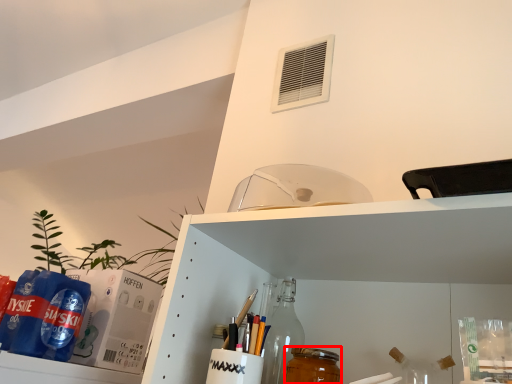
Question: From the image's perspective, considering the relative positions of beverage (annotated by the red box) and air conditioning in the image provided, where is beverage (annotated by the red box) located with respect to the staircase?

Choices:
 (A) above
 (B) below

Answer: (B)